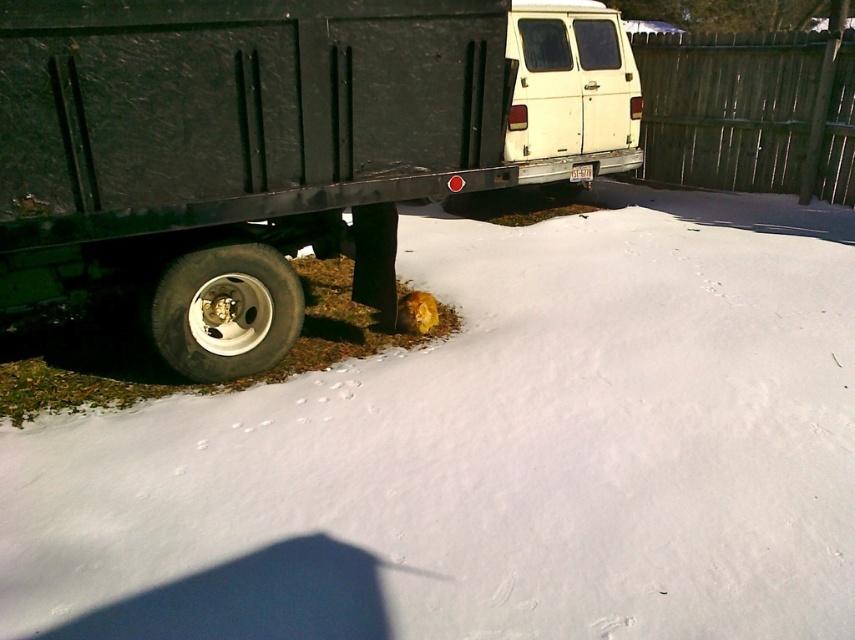
Who is lower down, wooden fence at upper right or white matte van at upper center?

white matte van at upper center is lower down.

The width and height of the screenshot is (855, 640). Describe the element at coordinates (749, 112) in the screenshot. I see `wooden fence at upper right` at that location.

Is point (744, 116) positioned after point (553, 4)?

Yes, point (744, 116) is farther from viewer.

This screenshot has width=855, height=640. I want to click on wooden fence at upper right, so click(x=749, y=112).

Who is positioned more to the right, matte black truck at lower left or black rubber tire at lower left?

Positioned to the right is matte black truck at lower left.

Can you confirm if matte black truck at lower left is bigger than black rubber tire at lower left?

Indeed, matte black truck at lower left has a larger size compared to black rubber tire at lower left.

At what (x,y) coordinates should I click in order to perform the action: click on matte black truck at lower left. Please return your answer as a coordinate pair (x, y). The height and width of the screenshot is (640, 855). Looking at the image, I should click on (279, 145).

Can you confirm if white matte van at upper center is bigger than black rubber tire at lower left?

Yes, white matte van at upper center is bigger than black rubber tire at lower left.

Can you confirm if white matte van at upper center is positioned to the right of black rubber tire at lower left?

Indeed, white matte van at upper center is positioned on the right side of black rubber tire at lower left.

Locate an element on the screen. white matte van at upper center is located at coordinates (570, 92).

In order to click on white matte van at upper center in this screenshot , I will do `click(570, 92)`.